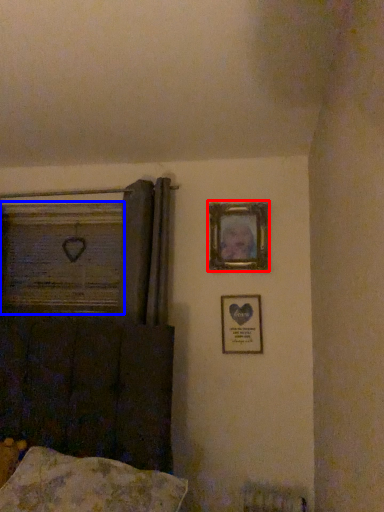
Question: Among these objects, which one is farthest to the camera, picture frame (highlighted by a red box) or window frame (highlighted by a blue box)?

Choices:
 (A) picture frame
 (B) window frame

Answer: (B)